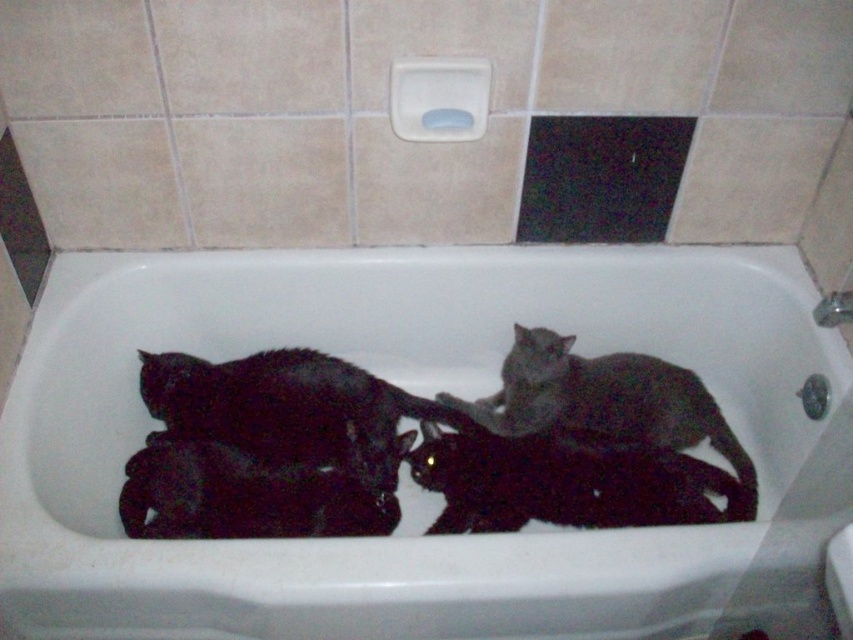
You are standing in the bathroom and want to place a small decorative item on the wall. You have two points marked on the wall where you can place it. The first point is at coordinate point (519,422) and the second is at point (309,515). If you want to place the item closer to the front of the wall, which point should you choose?

You should choose point (309,515) because point (519,422) is behind point (309,515), meaning the latter is closer to the front of the wall.

You are a photographer trying to capture a clear photo of the gray matte cat at center and the shiny black cat at center in the bathtub. Since the lighting is dim, you decide to use a flash. However, the flash might cause the cats to move. To minimize disturbance, you want to focus on the cat that is closer to the camera. Which cat should you focus on?

The gray matte cat at center is behind the shiny black cat at center, so the shiny black cat at center is closer to the camera. You should focus on the shiny black cat at center to minimize disturbance.

You are a photographer trying to capture a clear image of the shiny black cat at center. Since the white glossy bathtub at center might reflect light, could the bathtub interfere with your photo? Explain why or why not based on their positions.

The white glossy bathtub at center is closer to the viewer than the shiny black cat at center. This means the bathtub would likely reflect more light towards the camera, potentially causing glare or reflections that could interfere with capturing a clear image of the cat.